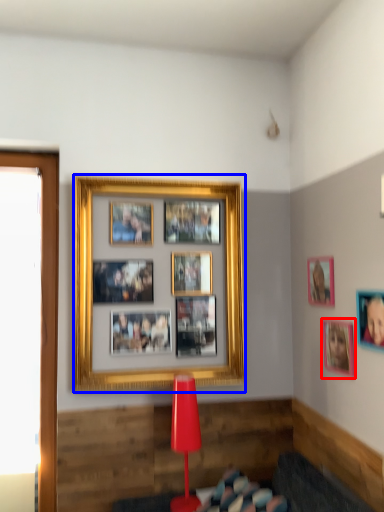
Question: Which point is closer to the camera, picture frame (highlighted by a red box) or picture frame (highlighted by a blue box)?

Choices:
 (A) picture frame
 (B) picture frame

Answer: (A)